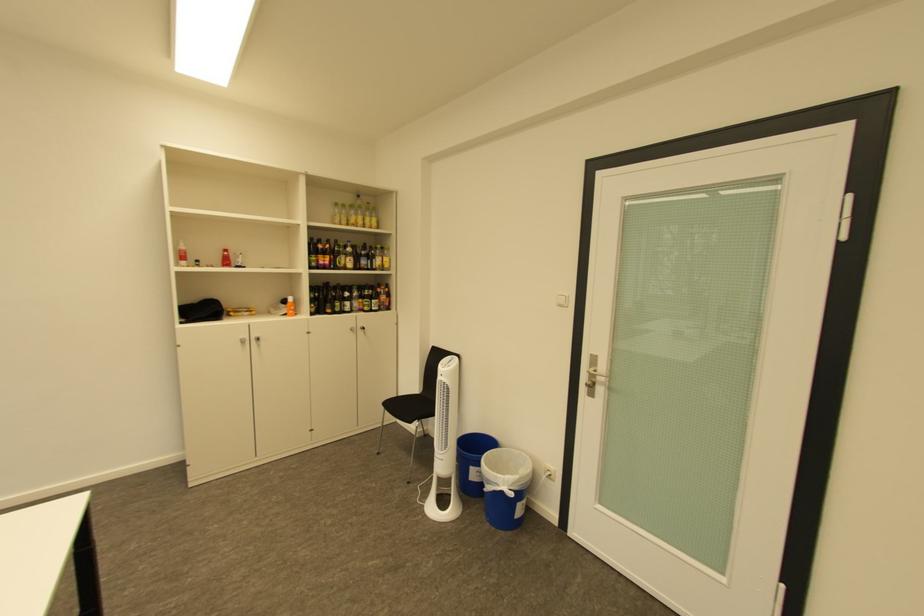
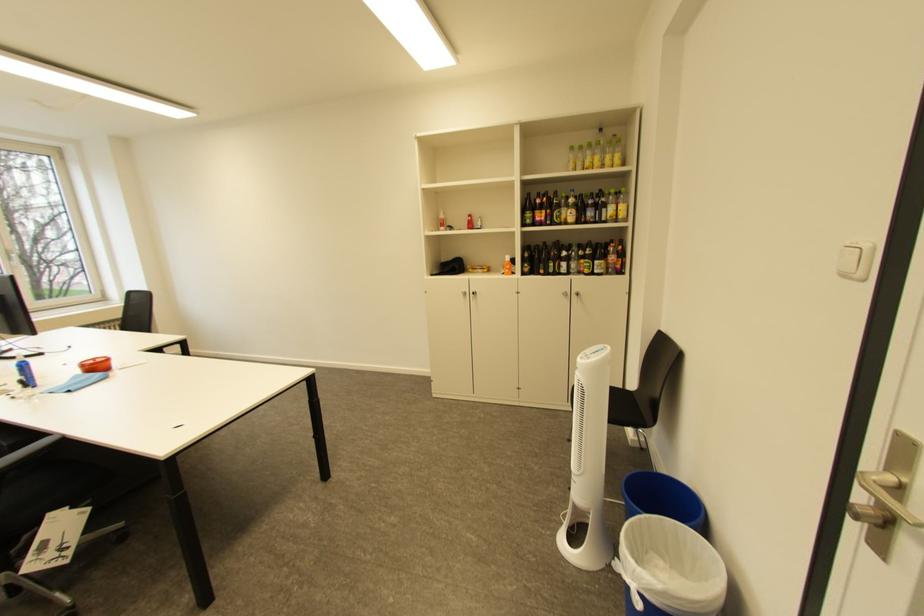
Find the pixel in the second image that matches the point at 347,305 in the first image.

(562, 265)